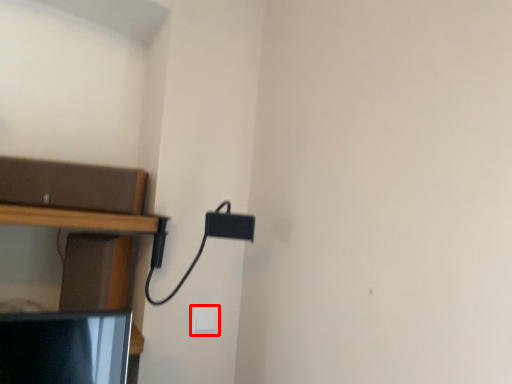
Question: From the image's perspective, what is the correct spatial relationship of light switch (annotated by the red box) in relation to shelf?

Choices:
 (A) above
 (B) below

Answer: (B)